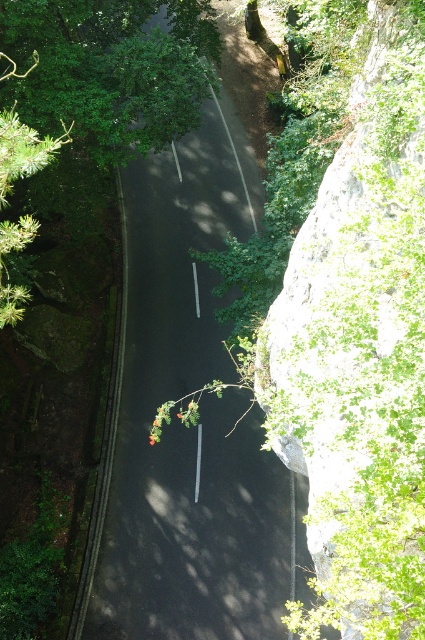
Question: Is black asphalt road at center bigger than green leafy tree at upper left?

Choices:
 (A) no
 (B) yes

Answer: (B)

Question: Is the position of black asphalt road at center more distant than that of green leafy tree at upper left?

Choices:
 (A) yes
 (B) no

Answer: (A)

Question: Among these objects, which one is nearest to the camera?

Choices:
 (A) green leafy tree at upper left
 (B) black asphalt road at center

Answer: (A)

Question: Is black asphalt road at center in front of green leafy tree at upper left?

Choices:
 (A) yes
 (B) no

Answer: (B)

Question: Among these objects, which one is farthest from the camera?

Choices:
 (A) green leafy tree at upper left
 (B) black asphalt road at center

Answer: (B)